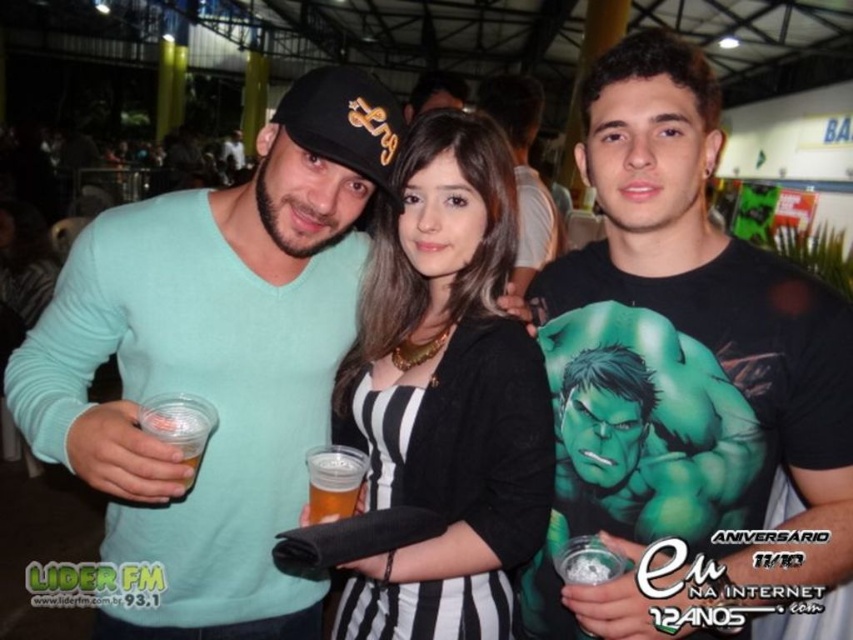
Question: Is black matte t-shirt at center below matte teal sweater at center?

Choices:
 (A) yes
 (B) no

Answer: (B)

Question: From the image, what is the correct spatial relationship of black matte t-shirt at center in relation to black matte shirt at center?

Choices:
 (A) below
 (B) above

Answer: (B)

Question: Which object is farther from the camera taking this photo?

Choices:
 (A) black matte shirt at center
 (B) black matte t-shirt at center
 (C) matte teal sweater at center

Answer: (A)

Question: Can you confirm if matte teal sweater at center is smaller than green fabric hulk at center?

Choices:
 (A) no
 (B) yes

Answer: (A)

Question: Which point is closer to the camera?

Choices:
 (A) (311, 170)
 (B) (839, 320)
 (C) (381, 557)
 (D) (520, 104)

Answer: (B)

Question: Which point appears closest to the camera in this image?

Choices:
 (A) (685, 548)
 (B) (669, 444)
 (C) (531, 192)
 (D) (128, 516)

Answer: (A)